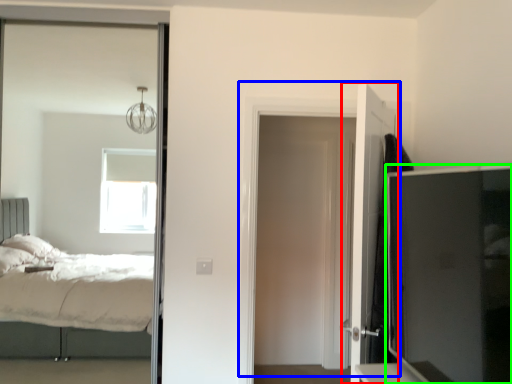
Question: Which object is the farthest from door (highlighted by a red box)? Choose among these: door (highlighted by a blue box) or tv cabinet (highlighted by a green box).

Choices:
 (A) door
 (B) tv cabinet

Answer: (A)